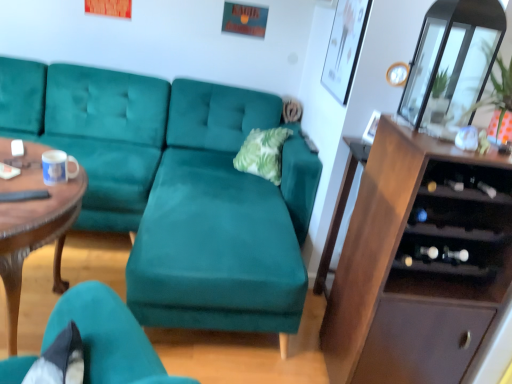
Question: From the image's perspective, does wooden polished coffee table at left appear higher than brown wood cabinet at right?

Choices:
 (A) yes
 (B) no

Answer: (A)

Question: Is the depth of wooden polished coffee table at left greater than that of brown wood cabinet at right?

Choices:
 (A) yes
 (B) no

Answer: (B)

Question: Is wooden polished coffee table at left facing towards brown wood cabinet at right?

Choices:
 (A) yes
 (B) no

Answer: (B)

Question: Considering the relative sizes of wooden polished coffee table at left and brown wood cabinet at right in the image provided, is wooden polished coffee table at left shorter than brown wood cabinet at right?

Choices:
 (A) no
 (B) yes

Answer: (B)

Question: Can you confirm if wooden polished coffee table at left is positioned to the left of brown wood cabinet at right?

Choices:
 (A) no
 (B) yes

Answer: (B)

Question: Are wooden polished coffee table at left and brown wood cabinet at right far apart?

Choices:
 (A) no
 (B) yes

Answer: (B)

Question: Can you confirm if white glossy mug at center is positioned to the left of teal velvet couch at center?

Choices:
 (A) no
 (B) yes

Answer: (B)

Question: From a real-world perspective, is white glossy mug at center beneath teal velvet couch at center?

Choices:
 (A) no
 (B) yes

Answer: (A)

Question: From the image's perspective, is white glossy mug at center located beneath teal velvet couch at center?

Choices:
 (A) no
 (B) yes

Answer: (A)

Question: Considering the relative sizes of white glossy mug at center and teal velvet couch at center in the image provided, is white glossy mug at center taller than teal velvet couch at center?

Choices:
 (A) no
 (B) yes

Answer: (A)

Question: From the image's perspective, is white glossy mug at center on top of teal velvet couch at center?

Choices:
 (A) no
 (B) yes

Answer: (B)

Question: Are white glossy mug at center and teal velvet couch at center making contact?

Choices:
 (A) yes
 (B) no

Answer: (B)

Question: From a real-world perspective, is teal velvet couch at center under white glossy mug at center?

Choices:
 (A) yes
 (B) no

Answer: (A)